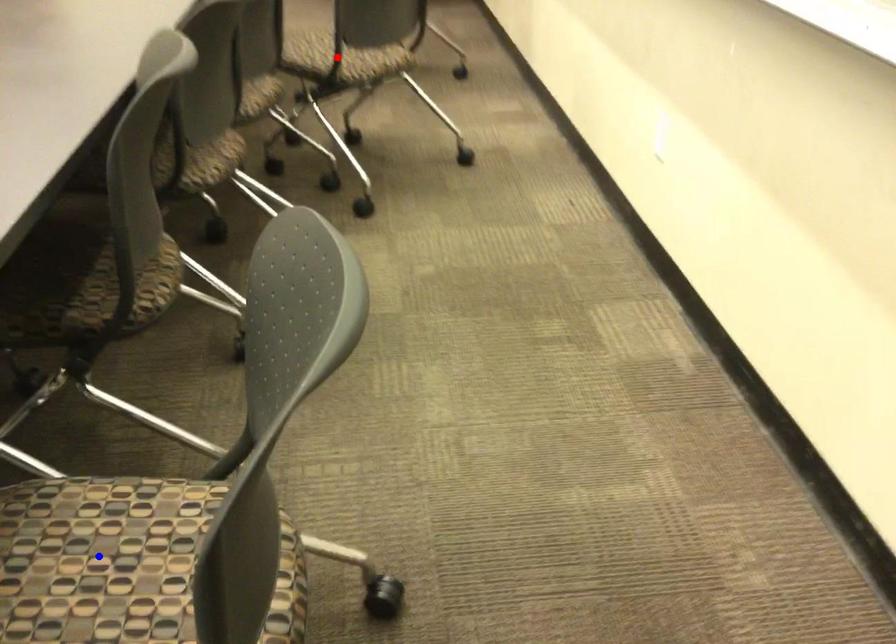
Question: In the image, two points are highlighted. Which point is nearer to the camera? Reply with the corresponding letter.

Choices:
 (A) blue point
 (B) red point

Answer: (A)